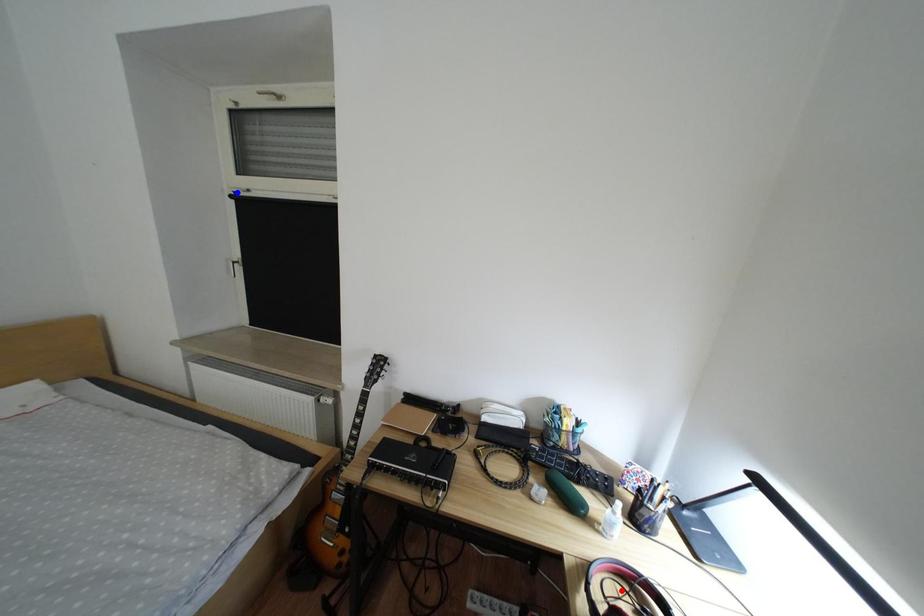
Question: Two points are marked on the image. Which point is closer to the camera?

Choices:
 (A) Blue point is closer.
 (B) Red point is closer.

Answer: (B)